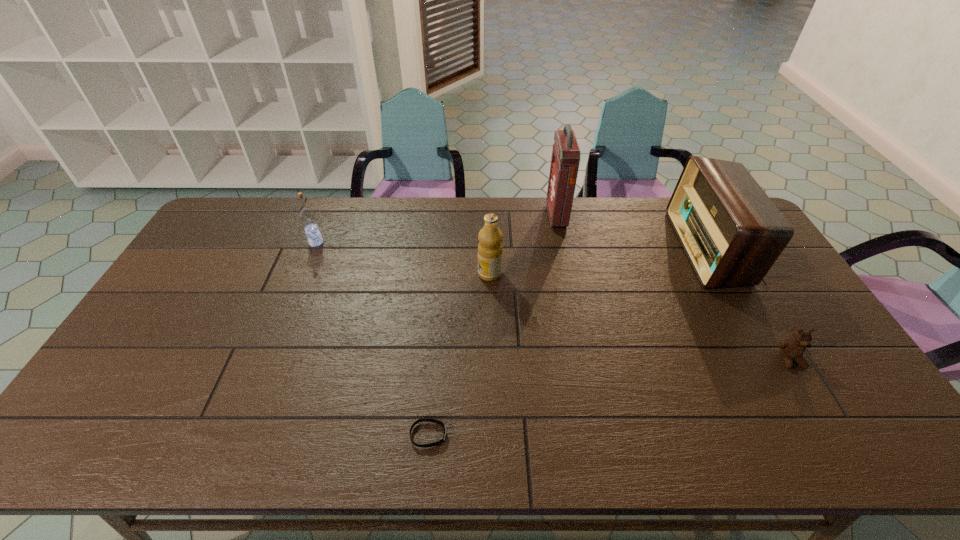
The width and height of the screenshot is (960, 540). I want to click on free area in between the vodka and the fourth object from left to right, so click(437, 230).

You are a GUI agent. You are given a task and a screenshot of the screen. Output one action in this format:
    pyautogui.click(x=<x>, y=<y>)
    Task: Click on the free space that is in between the leftmost object and the tallest object
    The width and height of the screenshot is (960, 540).
    Given the screenshot: What is the action you would take?
    (x=437, y=230)

Identify which object is located as the fifth nearest to the fifth tallest object. Please provide its 2D coordinates. Your answer should be formatted as a tuple, i.e. [(x, y)], where the tuple contains the x and y coordinates of a point satisfying the conditions above.

[(307, 216)]

Where is `the closest object to the teddy bear`? This screenshot has width=960, height=540. the closest object to the teddy bear is located at coordinates (732, 233).

Identify the location of free spot that satisfies the following two spatial constraints: 1. at the face of the teddy bear; 2. on the display of the nearest object. Image resolution: width=960 pixels, height=540 pixels. (835, 435).